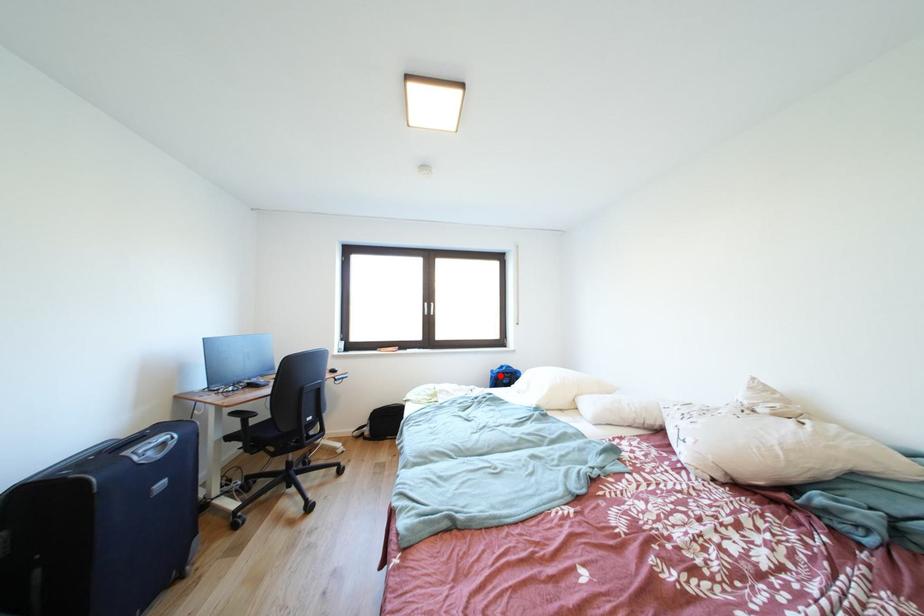
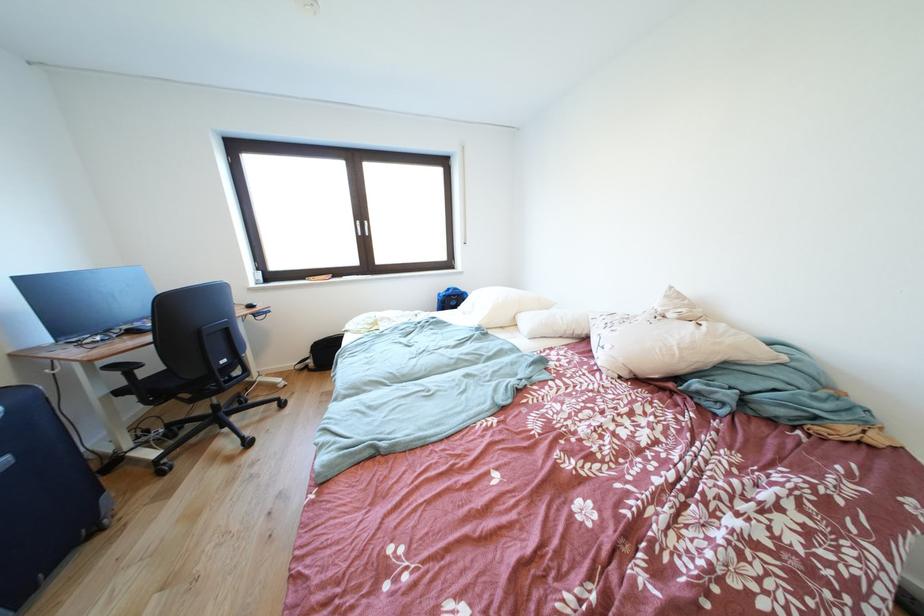
Question: I am providing you with two images of the same scene from different viewpoints. A red point is shown in image1. For the corresponding object point in image2, is it positioned nearer or farther from the camera?

Choices:
 (A) Nearer
 (B) Farther

Answer: (A)